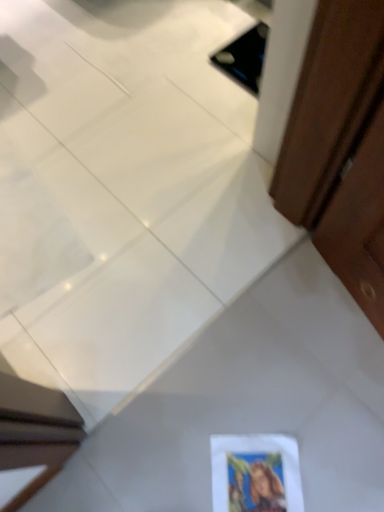
Where is `white paper postcard at lower center`? The width and height of the screenshot is (384, 512). white paper postcard at lower center is located at coordinates (256, 473).

The image size is (384, 512). Describe the element at coordinates (256, 473) in the screenshot. I see `white paper postcard at lower center` at that location.

Where is `white paper postcard at lower center`? The height and width of the screenshot is (512, 384). white paper postcard at lower center is located at coordinates (256, 473).